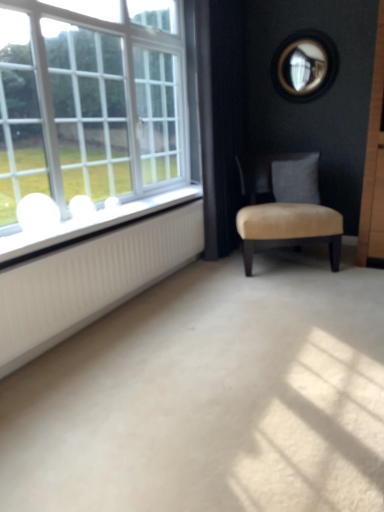
Question: From the image's perspective, is white glossy window sill at left beneath white ribbed radiator at left?

Choices:
 (A) yes
 (B) no

Answer: (B)

Question: Does white glossy window sill at left appear on the right side of white ribbed radiator at left?

Choices:
 (A) yes
 (B) no

Answer: (B)

Question: Considering the relative sizes of white glossy window sill at left and white ribbed radiator at left in the image provided, is white glossy window sill at left shorter than white ribbed radiator at left?

Choices:
 (A) no
 (B) yes

Answer: (B)

Question: Does white glossy window sill at left contain white ribbed radiator at left?

Choices:
 (A) no
 (B) yes

Answer: (A)

Question: Considering the relative sizes of white glossy window sill at left and white ribbed radiator at left in the image provided, is white glossy window sill at left taller than white ribbed radiator at left?

Choices:
 (A) no
 (B) yes

Answer: (A)

Question: Is the position of white glossy window sill at left more distant than that of white ribbed radiator at left?

Choices:
 (A) yes
 (B) no

Answer: (A)

Question: From the image's perspective, is white glossy window sill at left located above beige velvet chair at center?

Choices:
 (A) no
 (B) yes

Answer: (A)

Question: Considering the relative sizes of white glossy window sill at left and beige velvet chair at center in the image provided, is white glossy window sill at left bigger than beige velvet chair at center?

Choices:
 (A) yes
 (B) no

Answer: (B)

Question: Are white glossy window sill at left and beige velvet chair at center beside each other?

Choices:
 (A) yes
 (B) no

Answer: (B)

Question: Can we say white glossy window sill at left lies outside beige velvet chair at center?

Choices:
 (A) yes
 (B) no

Answer: (A)

Question: Is white glossy window sill at left aimed at beige velvet chair at center?

Choices:
 (A) yes
 (B) no

Answer: (B)

Question: Are white glossy window sill at left and beige velvet chair at center far apart?

Choices:
 (A) no
 (B) yes

Answer: (A)

Question: Is white ribbed radiator at left inside beige velvet chair at center?

Choices:
 (A) yes
 (B) no

Answer: (B)